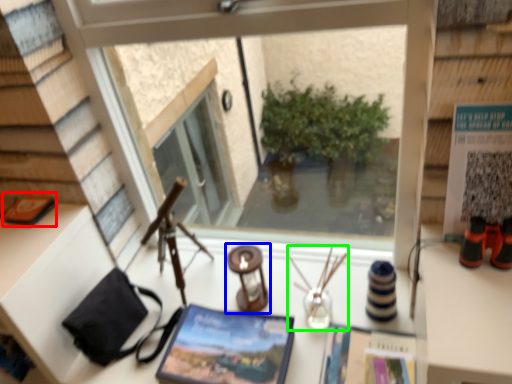
Question: Which is nearer to the book (highlighted by a red box)? candle holder (highlighted by a blue box) or candle holder (highlighted by a green box).

Choices:
 (A) candle holder
 (B) candle holder

Answer: (A)